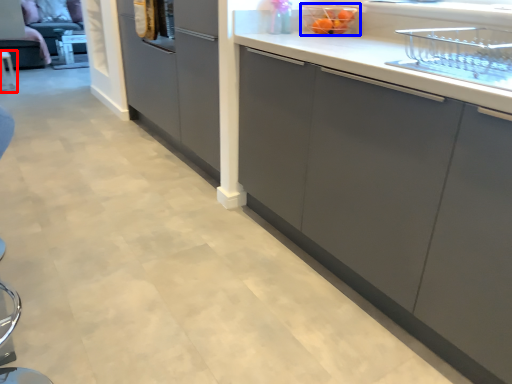
Question: Which point is further to the camera, furniture (highlighted by a red box) or appliance (highlighted by a blue box)?

Choices:
 (A) furniture
 (B) appliance

Answer: (A)